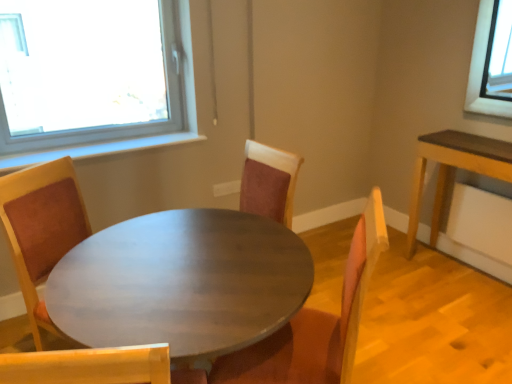
At what (x,y) coordinates should I click in order to perform the action: click on matte wood table at center. Please return your answer as a coordinate pair (x, y). Image resolution: width=512 pixels, height=384 pixels. Looking at the image, I should click on click(181, 283).

The image size is (512, 384). What do you see at coordinates (181, 283) in the screenshot? I see `matte wood table at center` at bounding box center [181, 283].

What is the approximate width of suede-like brown chair at center?

suede-like brown chair at center is 21.84 inches wide.

Where is `suede-like brown chair at center`? The width and height of the screenshot is (512, 384). suede-like brown chair at center is located at coordinates (315, 324).

Describe the element at coordinates (315, 324) in the screenshot. I see `suede-like brown chair at center` at that location.

The width and height of the screenshot is (512, 384). What are the coordinates of `matte wood table at center` in the screenshot? It's located at (181, 283).

Which object is positioned more to the right, matte wood table at center or suede-like brown chair at center?

Positioned to the right is suede-like brown chair at center.

Between matte wood table at center and suede-like brown chair at center, which one is positioned behind?

suede-like brown chair at center is more distant.

Is point (191, 222) positioned behind point (372, 231)?

That is True.

From the image's perspective, is matte wood table at center above suede-like brown chair at center?

No, from the image's perspective, matte wood table at center is not above suede-like brown chair at center.

From a real-world perspective, is matte wood table at center located beneath suede-like brown chair at center?

Yes, from a real-world perspective, matte wood table at center is under suede-like brown chair at center.

Which of these two, matte wood table at center or suede-like brown chair at center, is thinner?

With smaller width is suede-like brown chair at center.

From their relative heights in the image, would you say matte wood table at center is taller or shorter than suede-like brown chair at center?

In the image, matte wood table at center appears to be shorter than suede-like brown chair at center.

Between matte wood table at center and suede-like brown chair at center, which one has larger size?

Bigger between the two is matte wood table at center.

Is suede-like brown chair at center inside matte wood table at center?

Indeed, suede-like brown chair at center is located within matte wood table at center.

Is matte wood table at center positioned far away from suede-like brown chair at center?

Actually, matte wood table at center and suede-like brown chair at center are a little close together.

Could you tell me if matte wood table at center is turned towards suede-like brown chair at center?

Yes, matte wood table at center is oriented towards suede-like brown chair at center.

Measure the distance from matte wood table at center to suede-like brown chair at center.

A distance of 13.43 inches exists between matte wood table at center and suede-like brown chair at center.

Locate an element on the screen. This screenshot has width=512, height=384. coffee table in front of the suede-like brown chair at center is located at coordinates (181, 283).

Is suede-like brown chair at center at the right side of matte wood table at center?

Correct, you'll find suede-like brown chair at center to the right of matte wood table at center.

Which object is more forward, suede-like brown chair at center or matte wood table at center?

matte wood table at center.

Which is in front, point (356, 326) or point (250, 343)?

Point (250, 343)

From the image's perspective, is suede-like brown chair at center above matte wood table at center?

Yes.

From a real-world perspective, is suede-like brown chair at center physically located above or below matte wood table at center?

suede-like brown chair at center is situated higher than matte wood table at center in the real world.

Which object is thinner, suede-like brown chair at center or matte wood table at center?

suede-like brown chair at center is thinner.

Which of these two, suede-like brown chair at center or matte wood table at center, stands shorter?

matte wood table at center is shorter.

Who is smaller, suede-like brown chair at center or matte wood table at center?

With smaller size is suede-like brown chair at center.

Is suede-like brown chair at center not inside matte wood table at center?

No, suede-like brown chair at center is inside or overlapping with matte wood table at center.

Based on the photo, is suede-like brown chair at center next to matte wood table at center and touching it?

There is a gap between suede-like brown chair at center and matte wood table at center.

Is suede-like brown chair at center looking in the opposite direction of matte wood table at center?

Yes, suede-like brown chair at center is facing away from matte wood table at center.

Locate an element on the screen. chair located behind the matte wood table at center is located at coordinates (315, 324).

Where is `coffee table below the suede-like brown chair at center (from a real-world perspective)`? coffee table below the suede-like brown chair at center (from a real-world perspective) is located at coordinates (181, 283).

You are a GUI agent. You are given a task and a screenshot of the screen. Output one action in this format:
    pyautogui.click(x=<x>, y=<y>)
    Task: Click on the coffee table on the left of suede-like brown chair at center
    
    Given the screenshot: What is the action you would take?
    pyautogui.click(x=181, y=283)